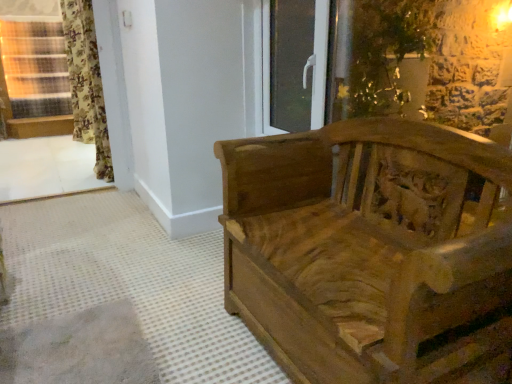
The width and height of the screenshot is (512, 384). Find the location of `free spot below wooden window frame at lower left (from a real-world perspective)`. free spot below wooden window frame at lower left (from a real-world perspective) is located at coordinates (24, 221).